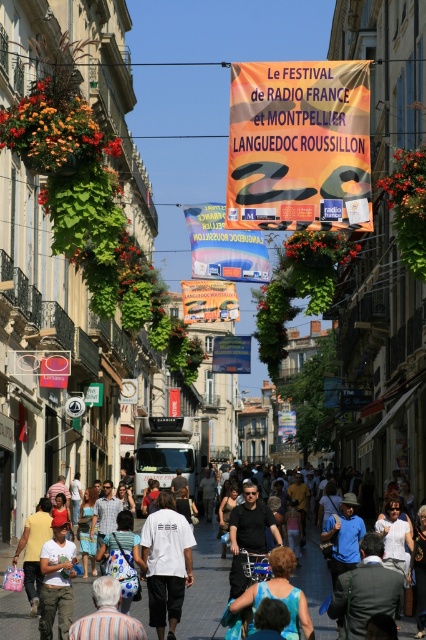
Between orange fabric banner at center and white cotton t-shirt at center, which one is positioned lower?

Positioned lower is white cotton t-shirt at center.

Is orange fabric banner at center smaller than white cotton t-shirt at center?

Incorrect, orange fabric banner at center is not smaller in size than white cotton t-shirt at center.

Between point (311, 173) and point (60, 577), which one is positioned in front?

Point (60, 577)

The image size is (426, 640). I want to click on orange fabric banner at center, so click(x=299, y=145).

Describe the element at coordinates (204, 588) in the screenshot. I see `smooth concrete pavement at center` at that location.

Is point (8, 636) closer to viewer compared to point (63, 609)?

No.

Identify the location of smooth concrete pavement at center. (204, 588).

Does blue fabric wheelchair at center have a lesser width compared to striped fabric at lower left?

No.

The image size is (426, 640). I want to click on blue fabric wheelchair at center, so click(279, 593).

Does point (298, 611) come in front of point (92, 630)?

No, (298, 611) is behind (92, 630).

The width and height of the screenshot is (426, 640). In order to click on blue fabric wheelchair at center in this screenshot , I will do `click(279, 593)`.